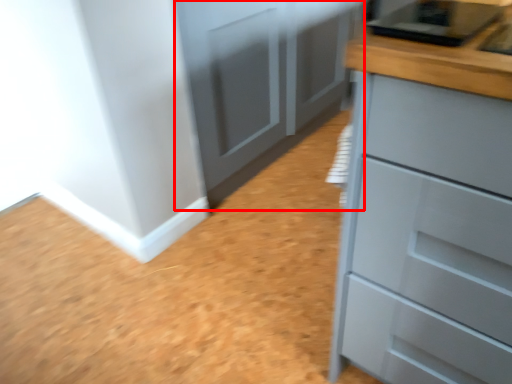
Question: From the image, what is the correct spatial relationship of cupboard (annotated by the red box) in relation to chest of drawers?

Choices:
 (A) right
 (B) left

Answer: (B)